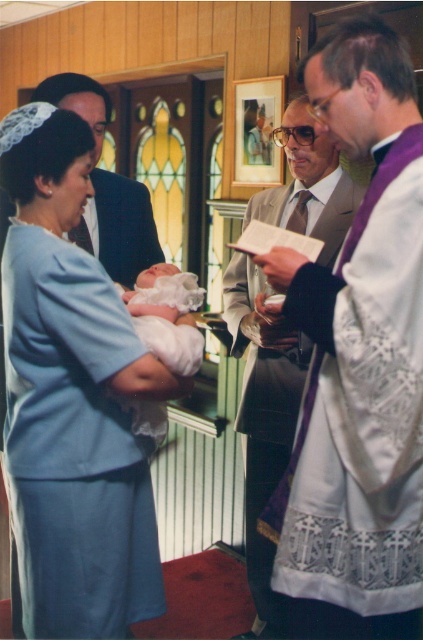
You are standing in the church and want to take a photo of the point at coordinates (408, 474). Your camera has a focal length of 50mm and you are currently 1.43 meters away from the point. Is the point within the camera focus range of 1 meter to 2 meters?

The distance of point (408, 474) from the camera is 1.43 meters, which falls within the focus range of 1 meter to 2 meters. Therefore, the point is within the camera focus range.

Based on the coordinates provided, which object corresponds to the point at [357,424]?

The purple lace robe at right corresponds to the point at [357,424].